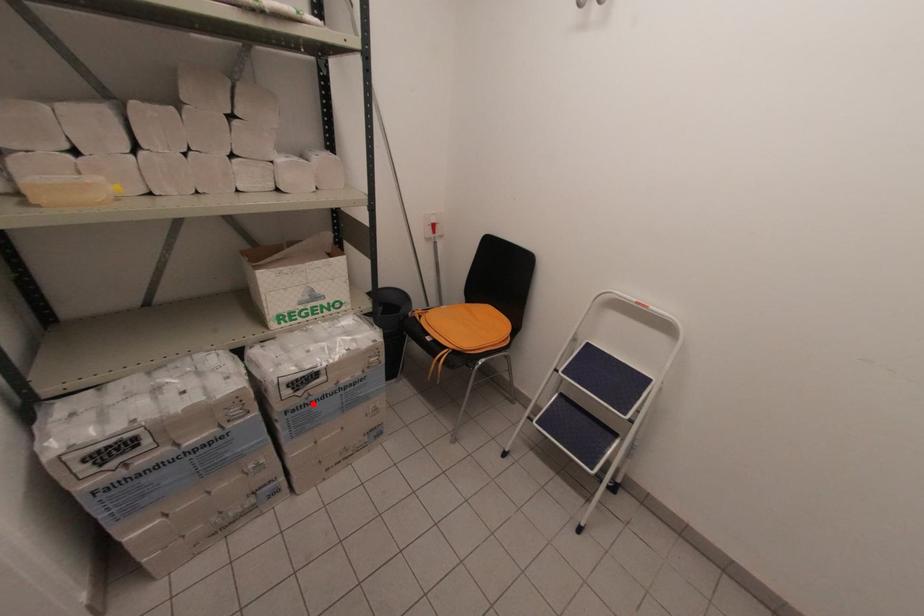
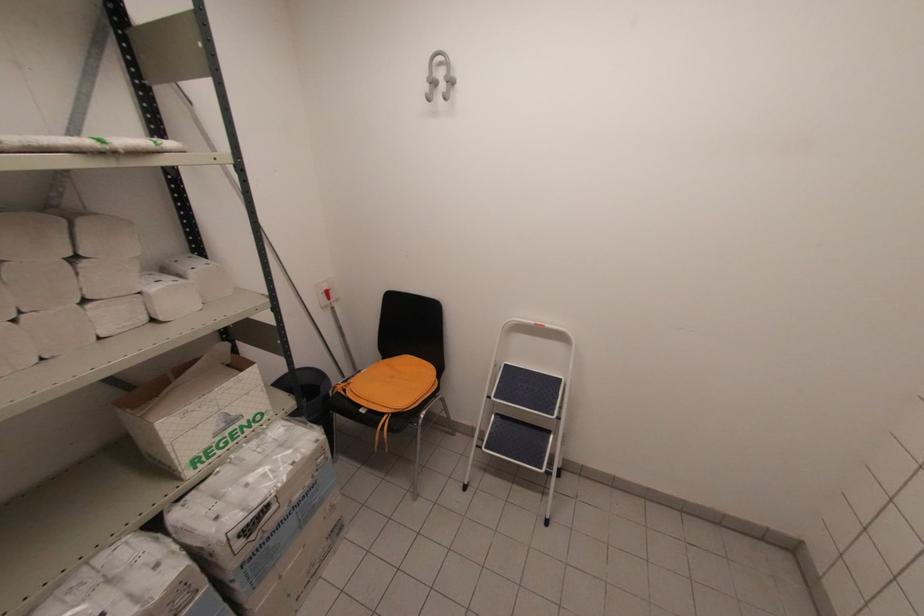
The point at the highlighted location is marked in the first image. Where is the corresponding point in the second image?

(271, 539)